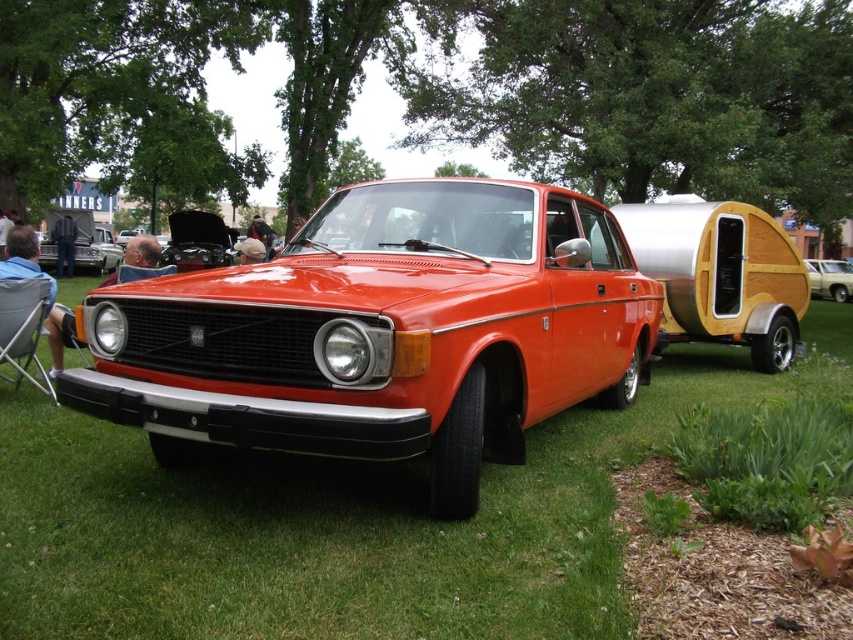
Question: Is wooden trailer at right above blue denim jeans at lower left?

Choices:
 (A) no
 (B) yes

Answer: (A)

Question: Which point is closer to the camera?

Choices:
 (A) matte black car at center
 (B) wooden trailer at right
 (C) blue denim jeans at lower left

Answer: (C)

Question: Which of the following is the farthest from the observer?

Choices:
 (A) (648, 259)
 (B) (84, 262)
 (C) (25, 616)
 (D) (18, 276)

Answer: (B)

Question: Which object is closer to the camera taking this photo?

Choices:
 (A) wooden trailer at right
 (B) green grass at center
 (C) denim pants at left

Answer: (B)

Question: Is green grass at center positioned behind metallic gold car at center?

Choices:
 (A) yes
 (B) no

Answer: (B)

Question: Can you confirm if glossy orange car at center is thinner than blue denim jeans at lower left?

Choices:
 (A) no
 (B) yes

Answer: (A)